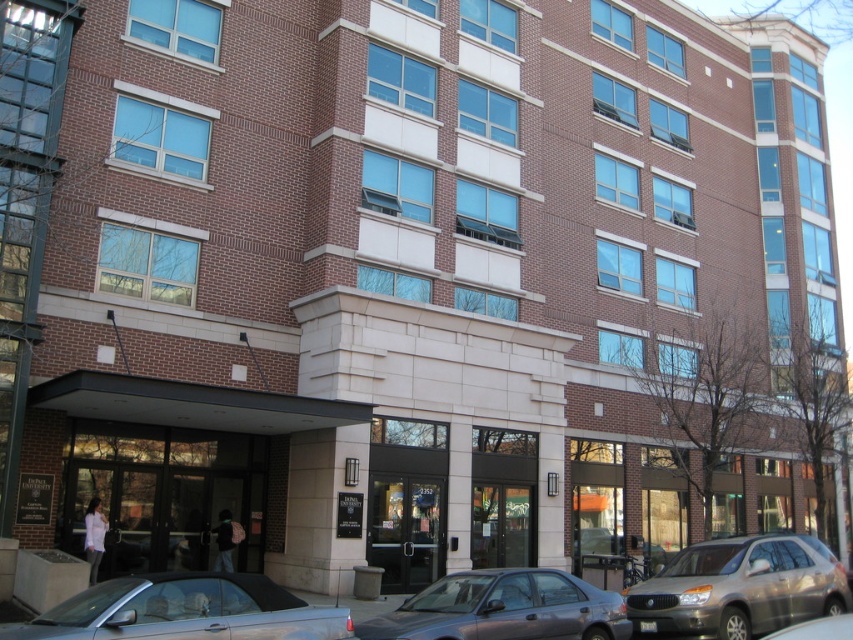
Question: Does silver metallic convertible at lower left appear under metallic gray sedan at center?

Choices:
 (A) yes
 (B) no

Answer: (B)

Question: Is silver metallic convertible at lower left positioned at the back of metallic gray sedan at center?

Choices:
 (A) yes
 (B) no

Answer: (B)

Question: Is silver metallic suv at lower right to the right of metallic gray sedan at center from the viewer's perspective?

Choices:
 (A) no
 (B) yes

Answer: (B)

Question: Which of the following is the closest to the observer?

Choices:
 (A) silver metallic convertible at lower left
 (B) silver metallic suv at lower right
 (C) metallic gray sedan at center

Answer: (A)

Question: Among these points, which one is farthest from the camera?

Choices:
 (A) (679, 554)
 (B) (113, 637)

Answer: (A)

Question: Which point is farther to the camera?

Choices:
 (A) (320, 628)
 (B) (529, 572)

Answer: (B)